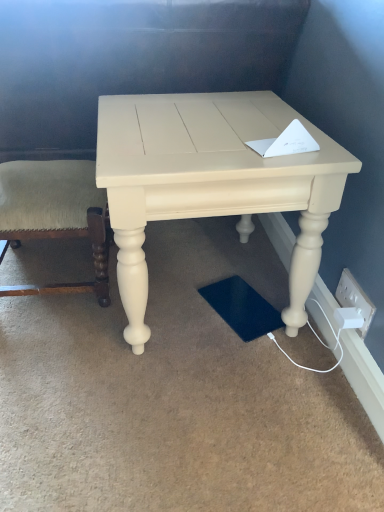
Question: Considering the relative positions of green fabric cushion at left and matte cream table at center in the image provided, is green fabric cushion at left to the left or to the right of matte cream table at center?

Choices:
 (A) left
 (B) right

Answer: (A)

Question: In terms of width, does green fabric cushion at left look wider or thinner when compared to matte cream table at center?

Choices:
 (A) thin
 (B) wide

Answer: (A)

Question: Estimate the real-world distances between objects in this image. Which object is closer to the matte cream table at center?

Choices:
 (A) green fabric cushion at left
 (B) white plastic socket at lower right
 (C) white plastic electric outlet at lower right

Answer: (A)

Question: Which of these objects is positioned closest to the white plastic socket at lower right?

Choices:
 (A) matte cream table at center
 (B) white plastic electric outlet at lower right
 (C) green fabric cushion at left

Answer: (B)